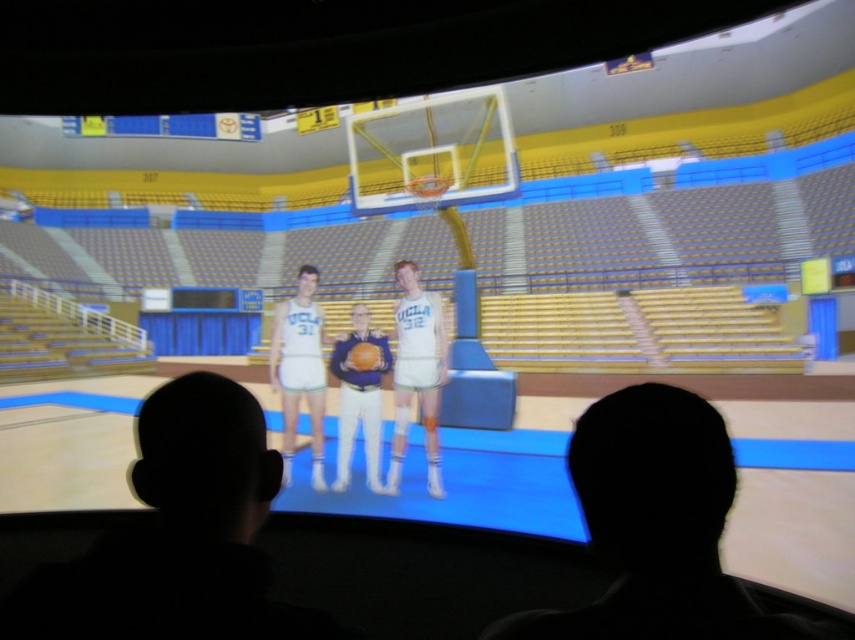
Question: Which point is farther to the camera?

Choices:
 (A) (340, 436)
 (B) (503, 180)

Answer: (B)

Question: Does metallic gold basketball hoop at upper center appear on the right side of white matte basketball uniform at center?

Choices:
 (A) yes
 (B) no

Answer: (B)

Question: Is white matte basketball uniform at center below orange matte basketball at center?

Choices:
 (A) no
 (B) yes

Answer: (B)

Question: Which object is positioned closest to the metallic gold basketball hoop at upper center?

Choices:
 (A) matte blue uniform at center
 (B) white matte basketball uniform at center
 (C) orange matte basketball at center

Answer: (B)

Question: Is white matte basketball uniform at center below matte blue uniform at center?

Choices:
 (A) yes
 (B) no

Answer: (B)

Question: Which object appears farthest from the camera in this image?

Choices:
 (A) orange matte basketball at center
 (B) matte blue uniform at center
 (C) white matte basketball uniform at center

Answer: (B)